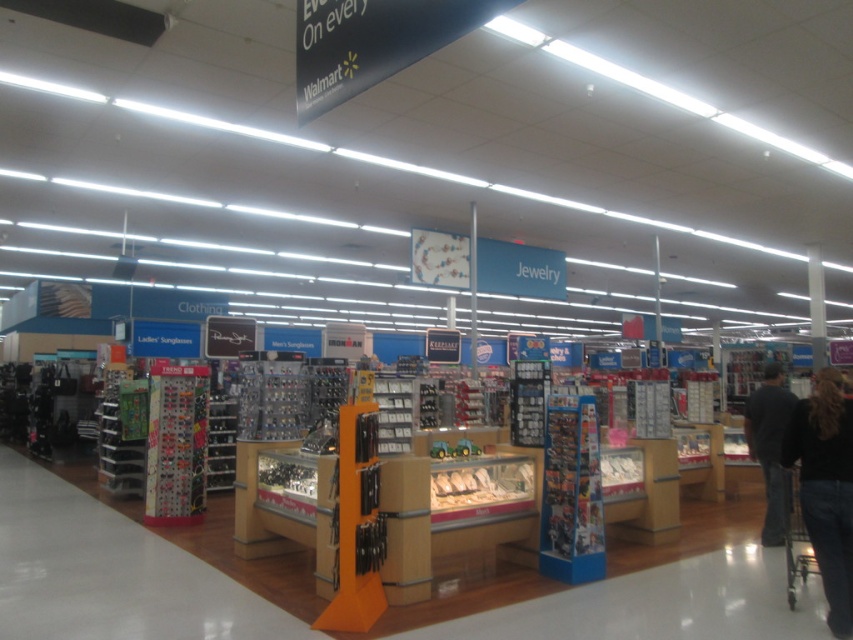
Question: Observing the image, what is the correct spatial positioning of black denim jeans at lower right in reference to black fabric pants at lower right?

Choices:
 (A) right
 (B) left

Answer: (B)

Question: Which of the following is the farthest from the observer?

Choices:
 (A) (770, 468)
 (B) (849, 464)
 (C) (802, 582)

Answer: (A)

Question: Does black denim jeans at lower right appear on the right side of black fabric pants at lower right?

Choices:
 (A) yes
 (B) no

Answer: (B)

Question: Estimate the real-world distances between objects in this image. Which object is farther from the metallic silver shopping cart at lower right?

Choices:
 (A) black fabric pants at lower right
 (B) black denim jeans at lower right

Answer: (B)

Question: Does black denim jeans at lower right appear under black fabric pants at lower right?

Choices:
 (A) yes
 (B) no

Answer: (B)

Question: Which object is positioned closest to the metallic silver shopping cart at lower right?

Choices:
 (A) black fabric pants at lower right
 (B) black denim jeans at lower right

Answer: (A)